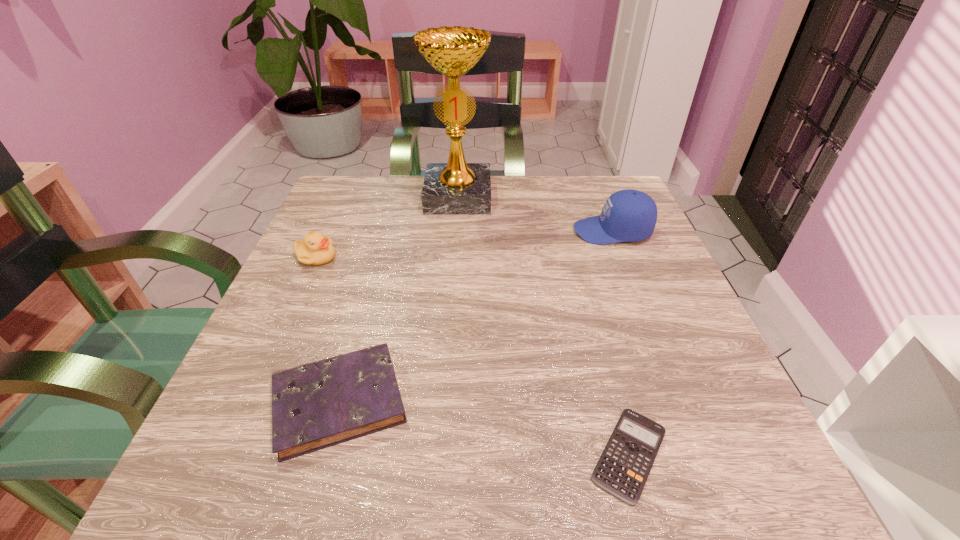
Locate an element on the screen. free location at the far right corner of the desktop is located at coordinates (579, 210).

The width and height of the screenshot is (960, 540). Identify the location of free spot between the shortest object and the duckling. (472, 356).

Locate an element on the screen. vacant point located between the fourth shortest object and the second shortest object is located at coordinates (476, 316).

You are a GUI agent. You are given a task and a screenshot of the screen. Output one action in this format:
    pyautogui.click(x=<x>, y=<y>)
    Task: Click on the free space between the third shortest object and the fourth tallest object
    The height and width of the screenshot is (540, 960).
    Given the screenshot: What is the action you would take?
    pyautogui.click(x=327, y=329)

Locate an element on the screen. This screenshot has height=540, width=960. vacant area that lies between the tallest object and the diary is located at coordinates (398, 299).

Identify the location of free space between the shortest object and the cap. (621, 343).

Locate an element on the screen. unoccupied position between the duckling and the shortest object is located at coordinates (472, 356).

Identify the location of free area in between the farthest object and the cap. (535, 214).

Identify the location of vacant region between the third tallest object and the fourth tallest object. (327, 329).

Find the location of a particular element. The width and height of the screenshot is (960, 540). free space between the calculator and the second tallest object is located at coordinates (621, 343).